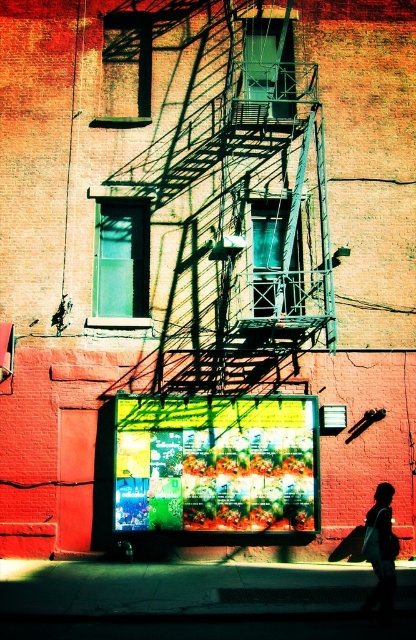
You are an electrician inspecting the building. You notice the green metal fire escape at center and the red wire at upper left. Which object is closer to you from your current vantage point?

The green metal fire escape at center is closer to you because it is in front of the red wire at upper left.

You are a delivery person who needs to place a package in a spot that is both visible and not obstructed by the fire escape. The silhouette bag at lower right and the red wire at upper left are already present. Which object should you choose as a reference point to ensure your package is placed in the most visible location?

The silhouette bag at lower right is larger in size than the red wire at upper left, so placing the package near the silhouette bag at lower right would make it more visible due to its larger size.

You are a delivery person trying to deliver a package to the address shown in the image. You see the green metal fire escape at center and the silhouette bag at lower right. Which object is closer to you, the delivery person?

The green metal fire escape at center is closer to you than the silhouette bag at lower right.